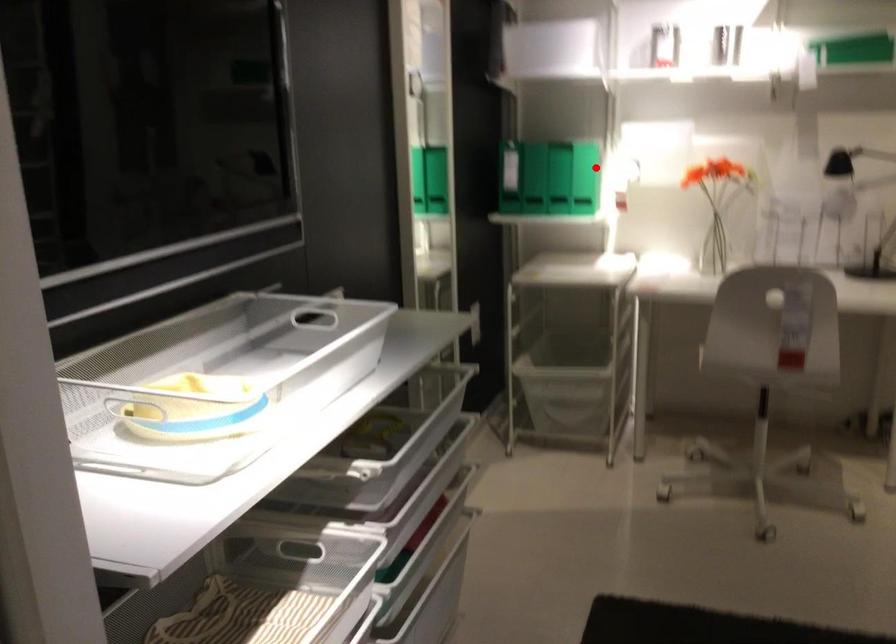
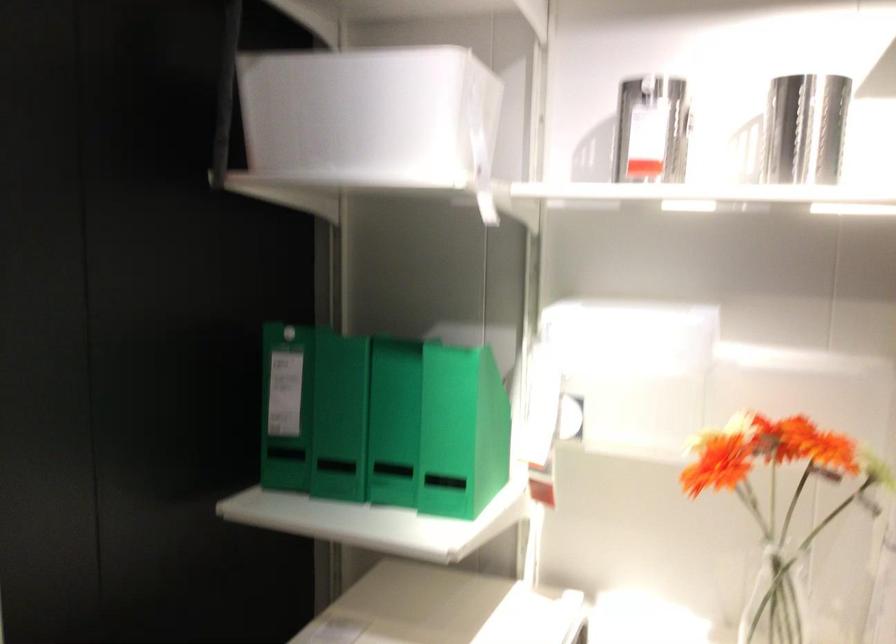
Question: I am providing you with two images of the same scene from different viewpoints. A red point is shown in image1. For the corresponding object point in image2, is it positioned nearer or farther from the camera?

Choices:
 (A) Nearer
 (B) Farther

Answer: (A)